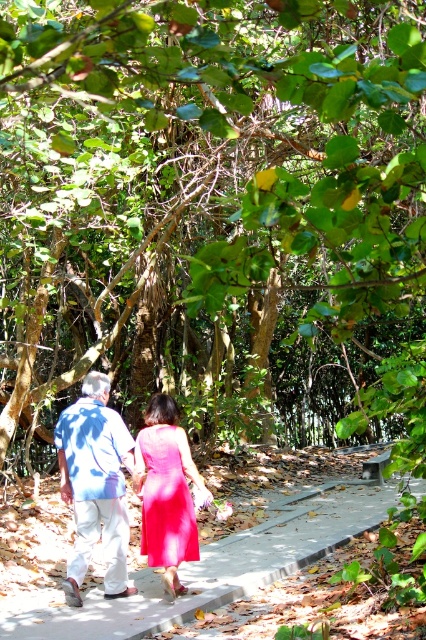
Question: Which point is closer to the camera?

Choices:
 (A) gray concrete pavement at center
 (B) blue cotton shirt at center

Answer: (A)

Question: Which point appears closest to the camera in this image?

Choices:
 (A) (19, 634)
 (B) (189, 548)
 (C) (131, 436)

Answer: (A)

Question: Does gray concrete pavement at center lie in front of matte pink dress at center?

Choices:
 (A) yes
 (B) no

Answer: (A)

Question: Is gray concrete pavement at center to the left of matte pink dress at center from the viewer's perspective?

Choices:
 (A) yes
 (B) no

Answer: (B)

Question: Which of the following is the farthest from the observer?

Choices:
 (A) (57, 435)
 (B) (152, 490)

Answer: (B)

Question: Observing the image, what is the correct spatial positioning of blue cotton shirt at center in reference to matte pink dress at center?

Choices:
 (A) above
 (B) below

Answer: (A)